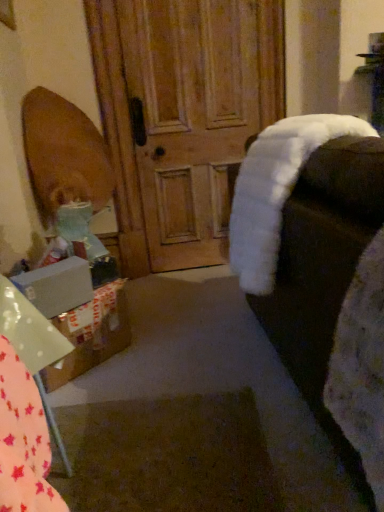
Locate an element on the screen. This screenshot has height=512, width=384. vacant space in front of wooden door at center is located at coordinates (203, 296).